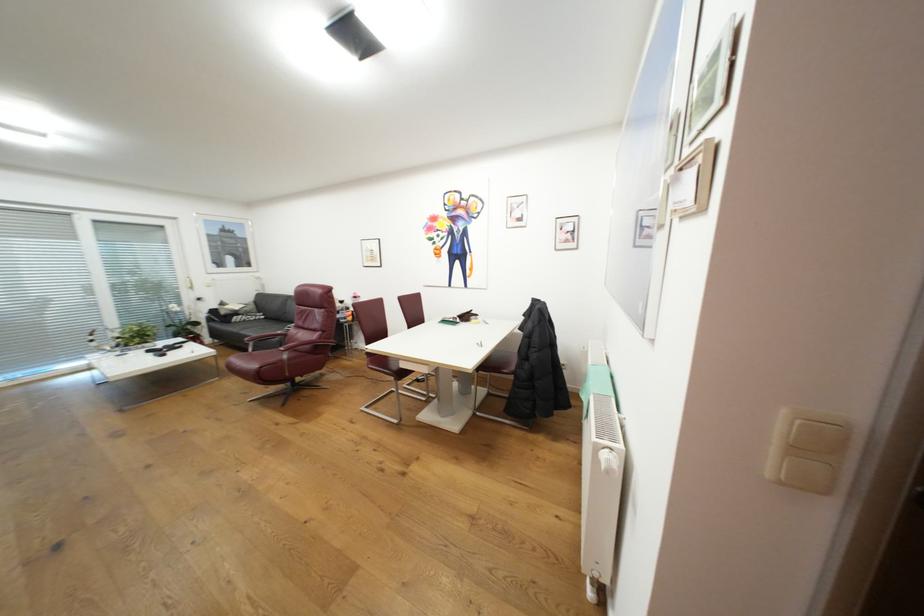
The width and height of the screenshot is (924, 616). What do you see at coordinates (609, 462) in the screenshot?
I see `the white radiator knob` at bounding box center [609, 462].